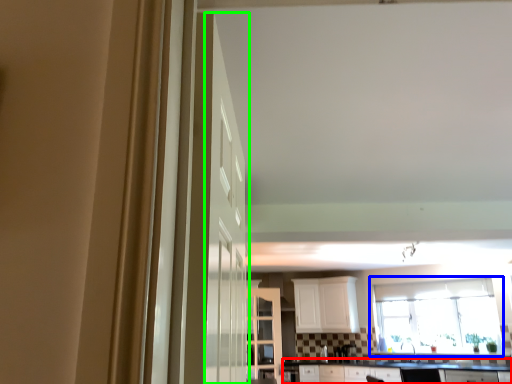
Question: Based on their relative distances, which object is farther from countertop (highlighted by a red box)? Choose from window (highlighted by a blue box) and door (highlighted by a green box).

Choices:
 (A) window
 (B) door

Answer: (B)